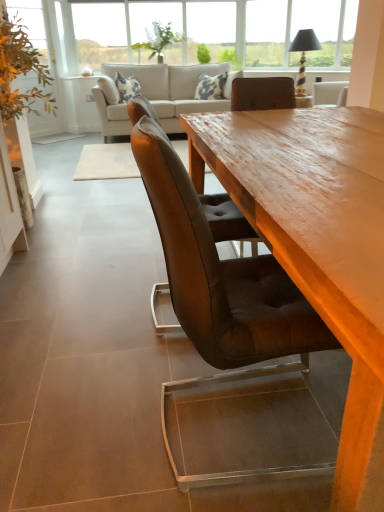
Question: Can you confirm if green leafy plant at left, marked as the first plant in a left-to-right arrangement, is smaller than brown leather chair at center?

Choices:
 (A) no
 (B) yes

Answer: (B)

Question: Is brown leather chair at center located within green leafy plant at left, which appears as the third plant when viewed from the right?

Choices:
 (A) no
 (B) yes

Answer: (A)

Question: From a real-world perspective, does green leafy plant at left, marked as the first plant in a left-to-right arrangement, sit lower than brown leather chair at center?

Choices:
 (A) no
 (B) yes

Answer: (A)

Question: Is green leafy plant at left, which appears as the third plant when viewed from the right, thinner than brown leather chair at center?

Choices:
 (A) yes
 (B) no

Answer: (A)

Question: Considering the relative sizes of green leafy plant at left, which appears as the third plant when viewed from the right, and brown leather chair at center in the image provided, is green leafy plant at left, which appears as the third plant when viewed from the right, taller than brown leather chair at center?

Choices:
 (A) no
 (B) yes

Answer: (B)

Question: In terms of width, does green leafy plant at upper center, which is the 2th plant in right-to-left order, look wider or thinner when compared to beige fabric couch at upper center?

Choices:
 (A) thin
 (B) wide

Answer: (A)

Question: Considering the positions of point (145, 48) and point (182, 71), is point (145, 48) closer or farther from the camera than point (182, 71)?

Choices:
 (A) closer
 (B) farther

Answer: (B)

Question: From the image's perspective, relative to beige fabric couch at upper center, is green leafy plant at upper center, the second plant in the left-to-right sequence, above or below?

Choices:
 (A) below
 (B) above

Answer: (B)

Question: Is green leafy plant at upper center, which is the 2th plant in right-to-left order, spatially inside beige fabric couch at upper center, or outside of it?

Choices:
 (A) outside
 (B) inside

Answer: (A)

Question: Is green leafy plant at upper center, the second plant in the left-to-right sequence, to the left or to the right of green leafy plant at upper center, acting as the 1th plant starting from the right, in the image?

Choices:
 (A) right
 (B) left

Answer: (B)

Question: Is point (157, 29) closer or farther from the camera than point (236, 56)?

Choices:
 (A) farther
 (B) closer

Answer: (B)

Question: In the image, is green leafy plant at upper center, the second plant in the left-to-right sequence, positioned in front of or behind green leafy plant at upper center, arranged as the 3th plant when viewed from the left?

Choices:
 (A) front
 (B) behind

Answer: (A)

Question: Is green leafy plant at upper center, which is the 2th plant in right-to-left order, wider or thinner than green leafy plant at upper center, acting as the 1th plant starting from the right?

Choices:
 (A) thin
 (B) wide

Answer: (B)

Question: In terms of size, does clear glass window at upper center appear bigger or smaller than wooden table at center?

Choices:
 (A) small
 (B) big

Answer: (A)

Question: Is clear glass window at upper center taller or shorter than wooden table at center?

Choices:
 (A) short
 (B) tall

Answer: (B)